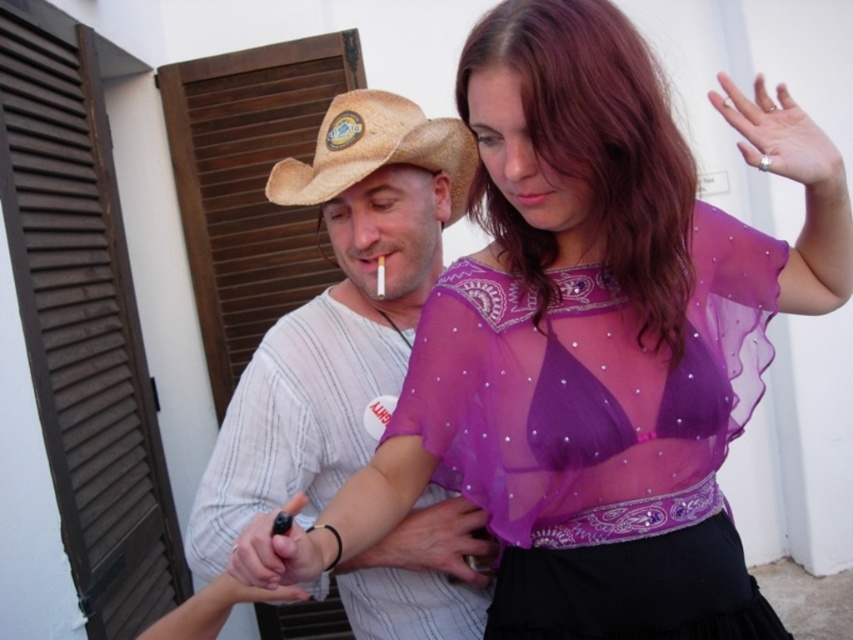
Image resolution: width=853 pixels, height=640 pixels. What do you see at coordinates (335, 314) in the screenshot? I see `straw hat at center` at bounding box center [335, 314].

Between point (280, 420) and point (347, 118), which one is positioned behind?

The point (347, 118) is more distant.

Where is `straw hat at center`? This screenshot has height=640, width=853. straw hat at center is located at coordinates (335, 314).

Can you confirm if brown wooden shutter at left is taller than strawhat at center?

Correct, brown wooden shutter at left is much taller as strawhat at center.

Is point (9, 166) closer to viewer compared to point (386, 150)?

No, it is behind (386, 150).

The width and height of the screenshot is (853, 640). In order to click on brown wooden shutter at left in this screenshot , I will do `click(83, 323)`.

Is sheer purple fabric dress at center above straw hat at center?

No.

Can you confirm if sheer purple fabric dress at center is positioned to the left of straw hat at center?

Incorrect, sheer purple fabric dress at center is not on the left side of straw hat at center.

Who is more distant from viewer, [473,445] or [428,493]?

The point [428,493] is more distant.

This screenshot has height=640, width=853. In order to click on sheer purple fabric dress at center in this screenshot , I will do `click(601, 436)`.